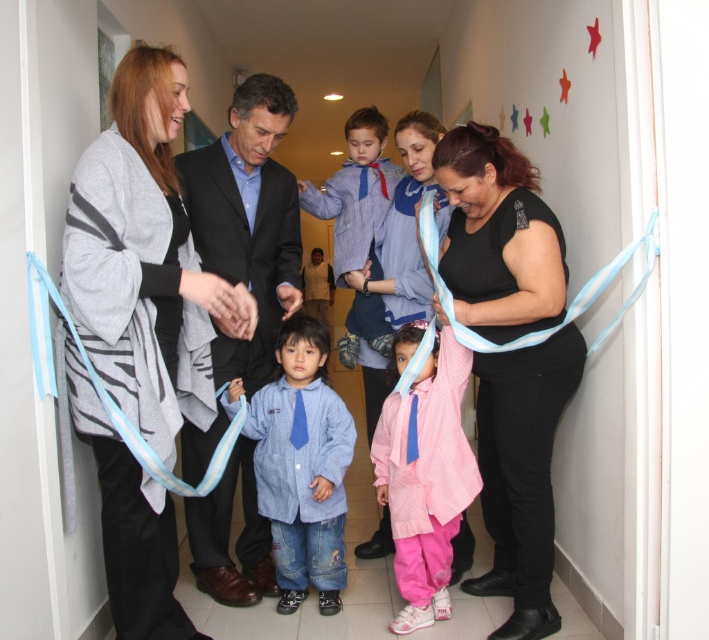
Which is more to the left, blue satin ribbon at left or light blue silky ribbon at right?

Positioned to the left is blue satin ribbon at left.

Does blue satin ribbon at left appear on the left side of light blue silky ribbon at right?

Yes, blue satin ribbon at left is to the left of light blue silky ribbon at right.

Where is `blue satin ribbon at left`? The height and width of the screenshot is (640, 709). blue satin ribbon at left is located at coordinates (111, 397).

Identify the location of blue satin ribbon at left. (111, 397).

Which is behind, point (452, 477) or point (346, 364)?

The point (346, 364) is behind.

Does point (413, 397) come in front of point (364, 131)?

Yes.

Between point (442, 330) and point (398, 173), which one is positioned behind?

The point (398, 173) is behind.

Where is `pink fabric dress at center`? pink fabric dress at center is located at coordinates (425, 480).

Who is positioned more to the right, black matte shirt at center or light blue silky ribbon at right?

black matte shirt at center is more to the right.

Is black matte shirt at center wider than light blue silky ribbon at right?

Incorrect, black matte shirt at center's width does not surpass light blue silky ribbon at right's.

The height and width of the screenshot is (640, 709). I want to click on black matte shirt at center, so click(523, 474).